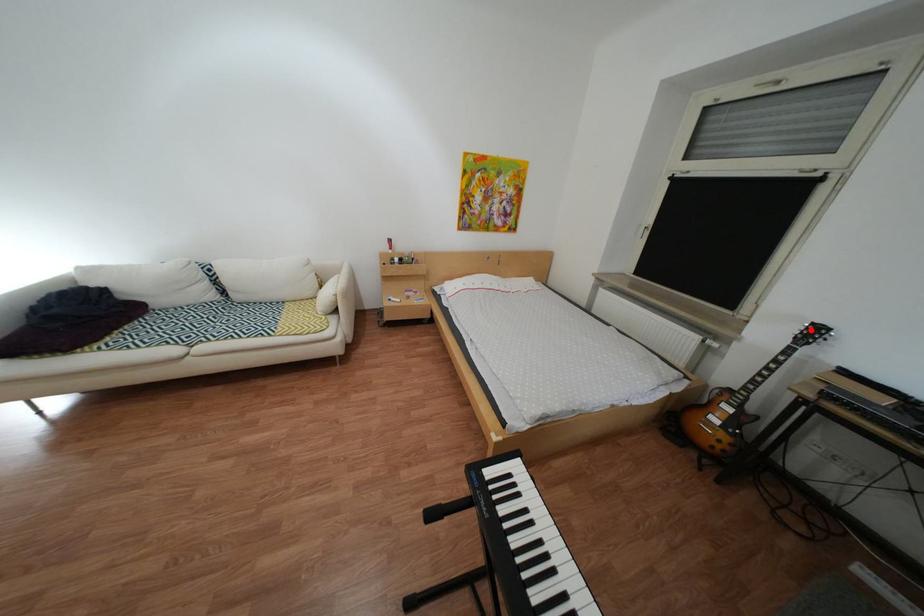
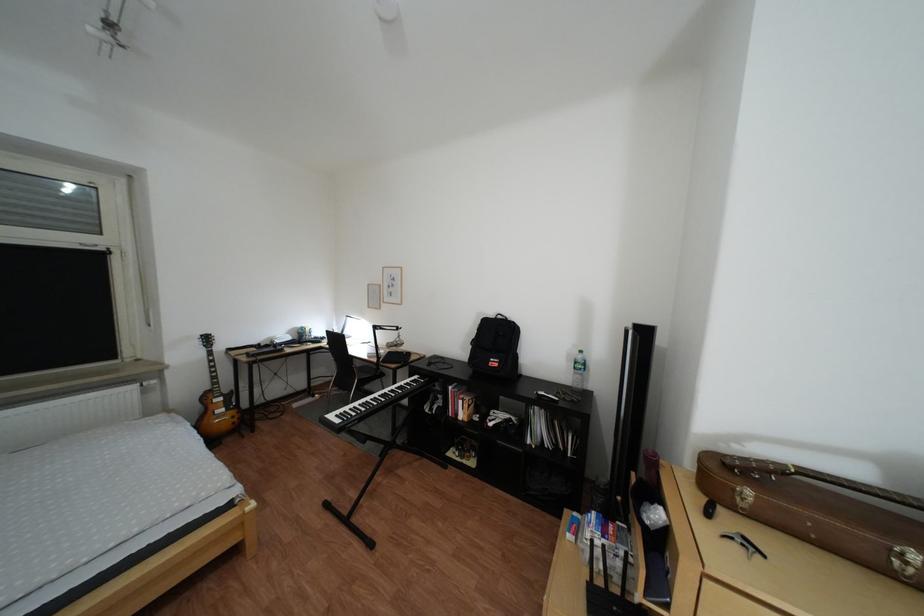
Question: I am providing you with two images of the same scene from different viewpoints. Image1 has a red point marked. In image2, the corresponding 3D location appears at what relative position? Reply with the corresponding letter.

Choices:
 (A) Closer
 (B) Farther

Answer: (A)